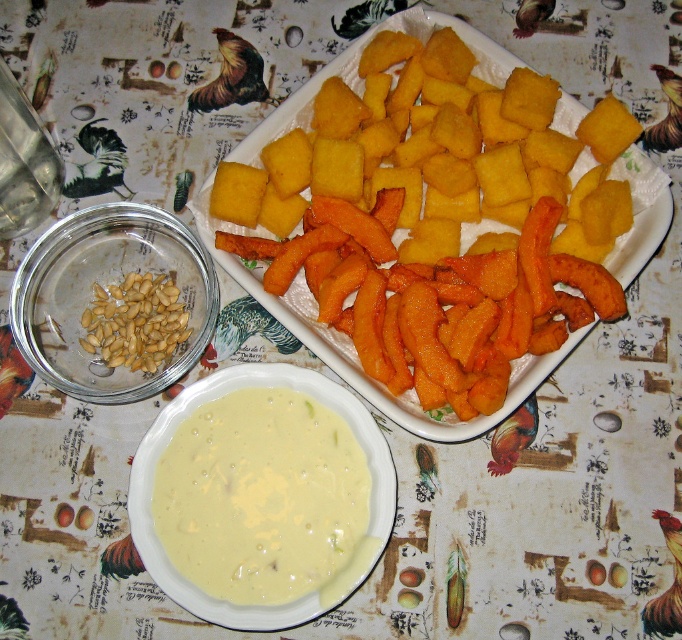
Does yellow fried polenta at center have a lesser height compared to creamy smooth soup at center?

Incorrect, yellow fried polenta at center's height does not fall short of creamy smooth soup at center's.

Does point (458, 433) come closer to viewer compared to point (207, 600)?

No, (458, 433) is behind (207, 600).

Which is behind, point (252, 154) or point (192, 385)?

Point (252, 154)

The width and height of the screenshot is (682, 640). What are the coordinates of `yellow fried polenta at center` in the screenshot? It's located at tap(355, 349).

Is golden brown seeds at left closer to the viewer compared to light brown smooth nuts at center left?

That is True.

Measure the distance between point (20,349) and camera.

A distance of 3.33 feet exists between point (20,349) and camera.

Does point (138, 244) come in front of point (158, 304)?

No.

Locate an element on the screen. The image size is (682, 640). golden brown seeds at left is located at coordinates (104, 284).

Who is more forward, (662, 214) or (162, 349)?

Positioned in front is point (662, 214).

Is yellow fried polenta at center further to camera compared to light brown smooth nuts at center left?

That is False.

Who is more forward, (256,276) or (162,314)?

Point (256,276) is in front.

Where is `yellow fried polenta at center`? yellow fried polenta at center is located at coordinates (355, 349).